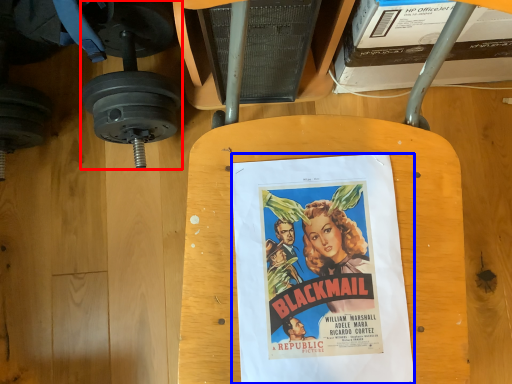
Question: Which object appears closest to the camera in this image, dumbbell (highlighted by a red box) or poster (highlighted by a blue box)?

Choices:
 (A) dumbbell
 (B) poster

Answer: (B)